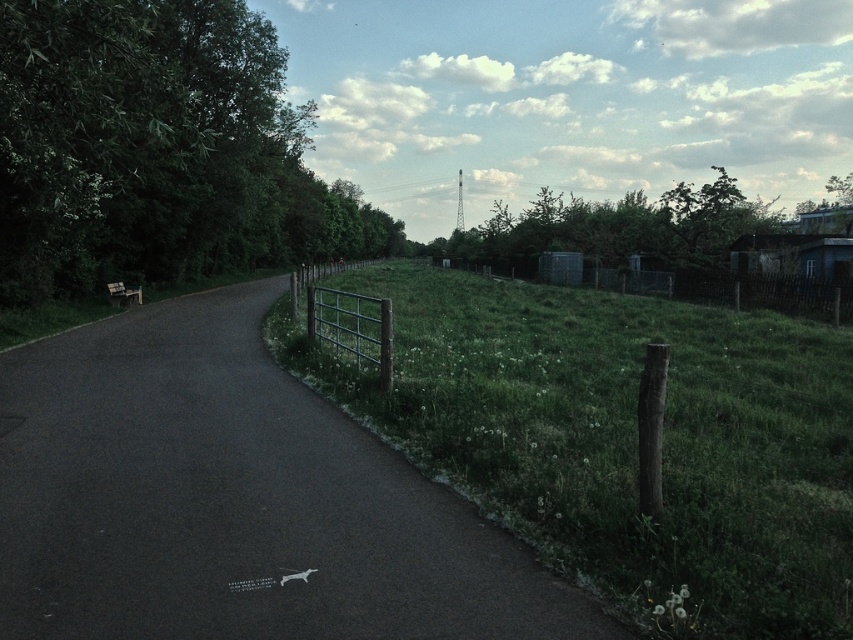
You are a hiker walking along the paved path in the rural scene. You notice the green leafy tree at left and the wooden fence at right. Which object is higher in position relative to the other?

The green leafy tree at left is above the wooden fence at right, so it is higher in position.